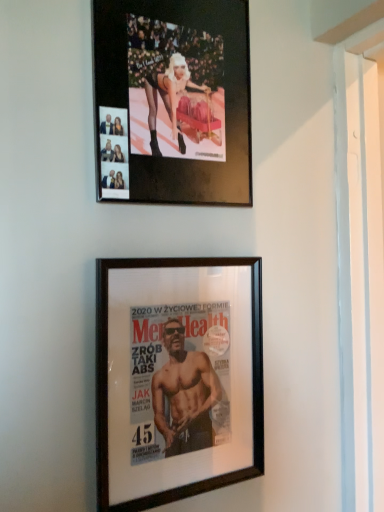
Question: From their relative heights in the image, would you say black wood picture frame at center, the 1th picture frame ordered from the bottom, is taller or shorter than metallic gold photo frame at upper center, acting as the 2th picture frame starting from the bottom?

Choices:
 (A) tall
 (B) short

Answer: (A)

Question: From a real-world perspective, is black wood picture frame at center, the second picture frame when ordered from top to bottom, above or below metallic gold photo frame at upper center, positioned as the 1th picture frame in top-to-bottom order?

Choices:
 (A) below
 (B) above

Answer: (A)

Question: Is point (99, 329) positioned closer to the camera than point (99, 9)?

Choices:
 (A) closer
 (B) farther

Answer: (A)

Question: Considering their positions, is metallic gold photo frame at upper center, acting as the 2th picture frame starting from the bottom, located in front of or behind black wood picture frame at center, the 1th picture frame ordered from the bottom?

Choices:
 (A) behind
 (B) front

Answer: (A)

Question: In terms of size, does metallic gold photo frame at upper center, positioned as the 1th picture frame in top-to-bottom order, appear bigger or smaller than black wood picture frame at center, the second picture frame when ordered from top to bottom?

Choices:
 (A) big
 (B) small

Answer: (A)

Question: Considering the positions of metallic gold photo frame at upper center, acting as the 2th picture frame starting from the bottom, and black wood picture frame at center, the second picture frame when ordered from top to bottom, in the image, is metallic gold photo frame at upper center, acting as the 2th picture frame starting from the bottom, wider or thinner than black wood picture frame at center, the second picture frame when ordered from top to bottom,?

Choices:
 (A) wide
 (B) thin

Answer: (A)

Question: Is metallic gold photo frame at upper center, acting as the 2th picture frame starting from the bottom, taller or shorter than black wood picture frame at center, the 1th picture frame ordered from the bottom?

Choices:
 (A) tall
 (B) short

Answer: (B)